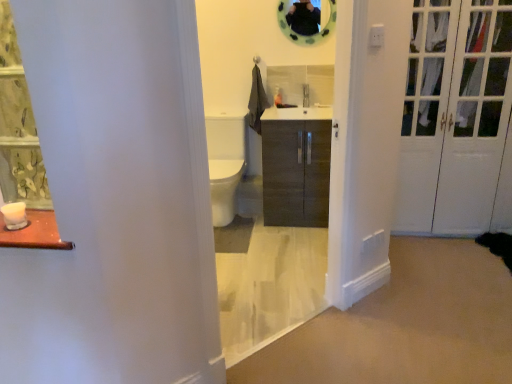
Identify the location of free space in front of green floral fabric curtain at left. (25, 211).